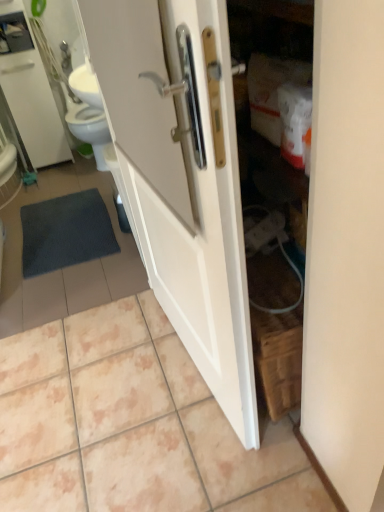
Question: Would you say white glossy tile at center is outside white glossy medicine cabinet at upper left?

Choices:
 (A) yes
 (B) no

Answer: (A)

Question: Is white glossy tile at center wider than white glossy medicine cabinet at upper left?

Choices:
 (A) yes
 (B) no

Answer: (A)

Question: Considering the relative sizes of white glossy tile at center and white glossy medicine cabinet at upper left in the image provided, is white glossy tile at center thinner than white glossy medicine cabinet at upper left?

Choices:
 (A) no
 (B) yes

Answer: (A)

Question: Is white glossy tile at center at the right side of white glossy medicine cabinet at upper left?

Choices:
 (A) no
 (B) yes

Answer: (B)

Question: Can you confirm if white glossy tile at center is taller than white glossy medicine cabinet at upper left?

Choices:
 (A) no
 (B) yes

Answer: (A)

Question: Looking at their shapes, would you say white glossy medicine cabinet at upper left is wider or thinner than dark gray textured bath mat at lower left?

Choices:
 (A) wide
 (B) thin

Answer: (B)

Question: Is white glossy medicine cabinet at upper left in front of or behind dark gray textured bath mat at lower left in the image?

Choices:
 (A) behind
 (B) front

Answer: (A)

Question: In the image, is white glossy medicine cabinet at upper left on the left side or the right side of dark gray textured bath mat at lower left?

Choices:
 (A) left
 (B) right

Answer: (A)

Question: Does point (29, 96) appear closer or farther from the camera than point (31, 256)?

Choices:
 (A) farther
 (B) closer

Answer: (A)

Question: Which is correct: white glossy door at center is inside white glossy medicine cabinet at upper left, or outside of it?

Choices:
 (A) outside
 (B) inside

Answer: (A)

Question: Is white glossy door at center in front of or behind white glossy medicine cabinet at upper left in the image?

Choices:
 (A) front
 (B) behind

Answer: (A)

Question: Looking at their shapes, would you say white glossy door at center is wider or thinner than white glossy medicine cabinet at upper left?

Choices:
 (A) thin
 (B) wide

Answer: (A)

Question: Would you say white glossy door at center is to the left or to the right of white glossy medicine cabinet at upper left in the picture?

Choices:
 (A) left
 (B) right

Answer: (B)

Question: In terms of width, does dark gray textured bath mat at lower left look wider or thinner when compared to white glossy medicine cabinet at upper left?

Choices:
 (A) thin
 (B) wide

Answer: (B)

Question: Is dark gray textured bath mat at lower left in front of or behind white glossy medicine cabinet at upper left in the image?

Choices:
 (A) behind
 (B) front

Answer: (B)